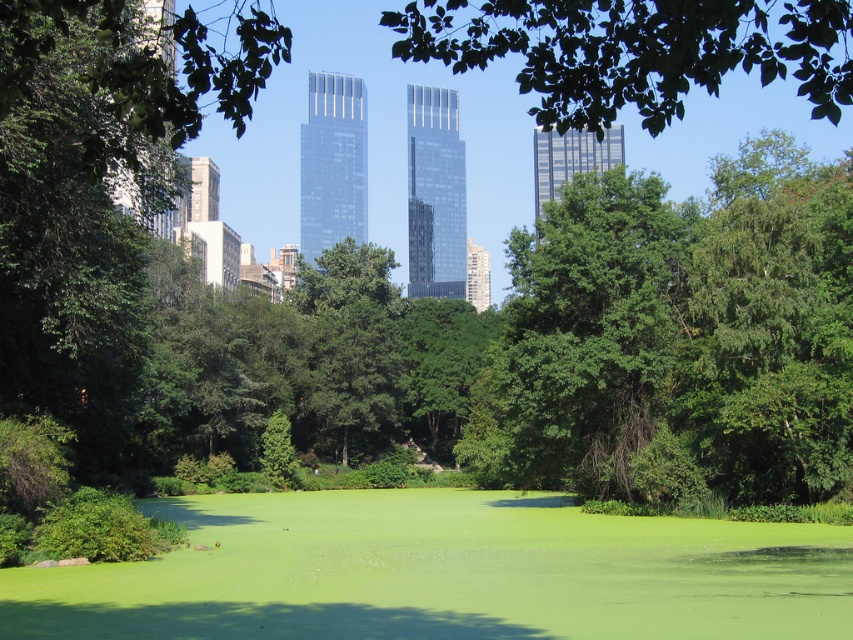
You are a park maintenance worker who needs to prune two green leafy trees. The trees are the green leafy tree at center and the green leafy tree at upper center. The minimum safe distance between two trees for pruning operations is 100 feet. Can you safely prune both trees at the same time?

The distance between the green leafy tree at center and the green leafy tree at upper center is 102.27 feet, which exceeds the minimum safe distance of 100 feet. Therefore, it is safe to prune both trees simultaneously.

You are standing in the park and want to take a photo of the green leafy tree at center and the green leafy tree at upper center. Which tree is positioned to the left when viewed from your perspective?

The green leafy tree at center is positioned to the left of the green leafy tree at upper center.